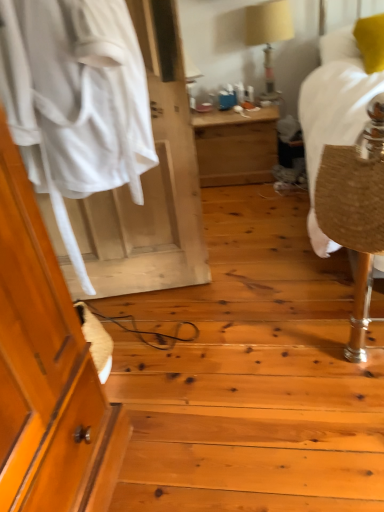
Identify the location of empty space that is ontop of wooden desk at center. (223, 110).